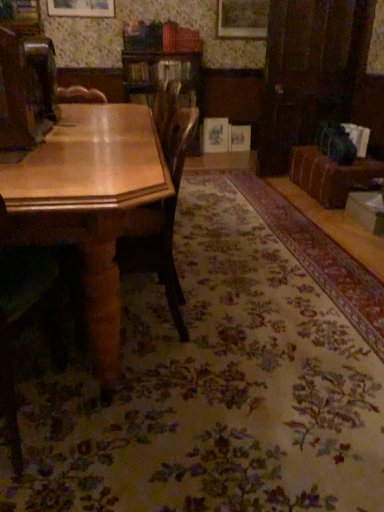
Question: Can you confirm if velvet brown couch at right is bigger than wooden chair at left, the 2th chair in the right-to-left sequence?

Choices:
 (A) no
 (B) yes

Answer: (B)

Question: Considering the relative sizes of velvet brown couch at right and wooden chair at left, the 2th chair in the right-to-left sequence, in the image provided, is velvet brown couch at right taller than wooden chair at left, the 2th chair in the right-to-left sequence,?

Choices:
 (A) yes
 (B) no

Answer: (B)

Question: Can you confirm if velvet brown couch at right is thinner than wooden chair at left, acting as the 1th chair starting from the left?

Choices:
 (A) yes
 (B) no

Answer: (B)

Question: From a real-world perspective, is velvet brown couch at right over wooden chair at left, the 2th chair in the right-to-left sequence?

Choices:
 (A) no
 (B) yes

Answer: (A)

Question: Does velvet brown couch at right turn towards wooden chair at left, acting as the 1th chair starting from the left?

Choices:
 (A) no
 (B) yes

Answer: (A)

Question: Looking at the image, does velvet brown couch at right seem bigger or smaller compared to wooden chair at left, acting as the 1th chair starting from the left?

Choices:
 (A) small
 (B) big

Answer: (B)

Question: Considering the positions of velvet brown couch at right and wooden chair at left, the 2th chair in the right-to-left sequence, in the image, is velvet brown couch at right wider or thinner than wooden chair at left, the 2th chair in the right-to-left sequence,?

Choices:
 (A) wide
 (B) thin

Answer: (A)

Question: In the image, is velvet brown couch at right positioned in front of or behind wooden chair at left, the 2th chair in the right-to-left sequence?

Choices:
 (A) front
 (B) behind

Answer: (B)

Question: From a real-world perspective, is velvet brown couch at right positioned above or below wooden chair at left, the 2th chair in the right-to-left sequence?

Choices:
 (A) below
 (B) above

Answer: (A)

Question: Is point (97, 216) positioned closer to the camera than point (301, 162)?

Choices:
 (A) closer
 (B) farther

Answer: (A)

Question: Considering their positions, is wooden table at left located in front of or behind velvet brown couch at right?

Choices:
 (A) front
 (B) behind

Answer: (A)

Question: Is wooden table at left bigger or smaller than velvet brown couch at right?

Choices:
 (A) big
 (B) small

Answer: (A)

Question: Looking at their shapes, would you say wooden table at left is wider or thinner than velvet brown couch at right?

Choices:
 (A) thin
 (B) wide

Answer: (B)

Question: Choose the correct answer: Is wooden chair at center, marked as the 1th chair in a right-to-left arrangement, inside velvet brown couch at right or outside it?

Choices:
 (A) inside
 (B) outside

Answer: (B)

Question: From the image's perspective, relative to velvet brown couch at right, is wooden chair at center, marked as the 1th chair in a right-to-left arrangement, above or below?

Choices:
 (A) below
 (B) above

Answer: (A)